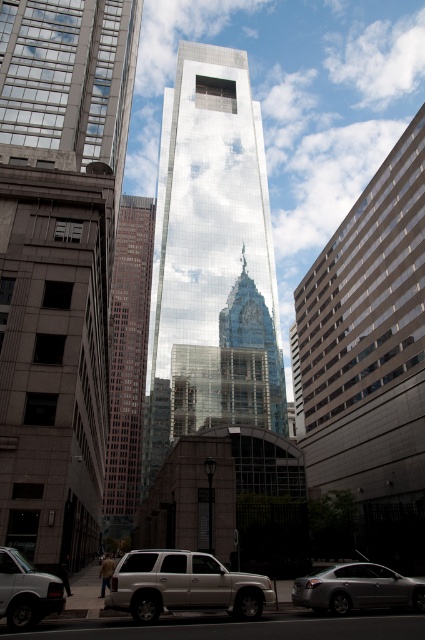
From the picture: Is brown brick building at center behind silver metallic suv at lower center?

Yes, it is behind silver metallic suv at lower center.

Can you confirm if brown brick building at center is positioned above silver metallic suv at lower center?

Yes.

Locate an element on the screen. The width and height of the screenshot is (425, 640). brown brick building at center is located at coordinates (127, 364).

Can you confirm if silver metallic sedan at lower right is thinner than matte silver van at lower left?

No.

Find the location of a particular element. silver metallic sedan at lower right is located at coordinates (357, 588).

Is point (193, 289) in front of point (176, 573)?

No, it is behind (176, 573).

Is reflective glass skyscraper at center to the right of silver metallic suv at lower center from the viewer's perspective?

Incorrect, reflective glass skyscraper at center is not on the right side of silver metallic suv at lower center.

Is point (257, 371) more distant than point (153, 580)?

Yes, point (257, 371) is behind point (153, 580).

Find the location of a particular element. reflective glass skyscraper at center is located at coordinates (210, 260).